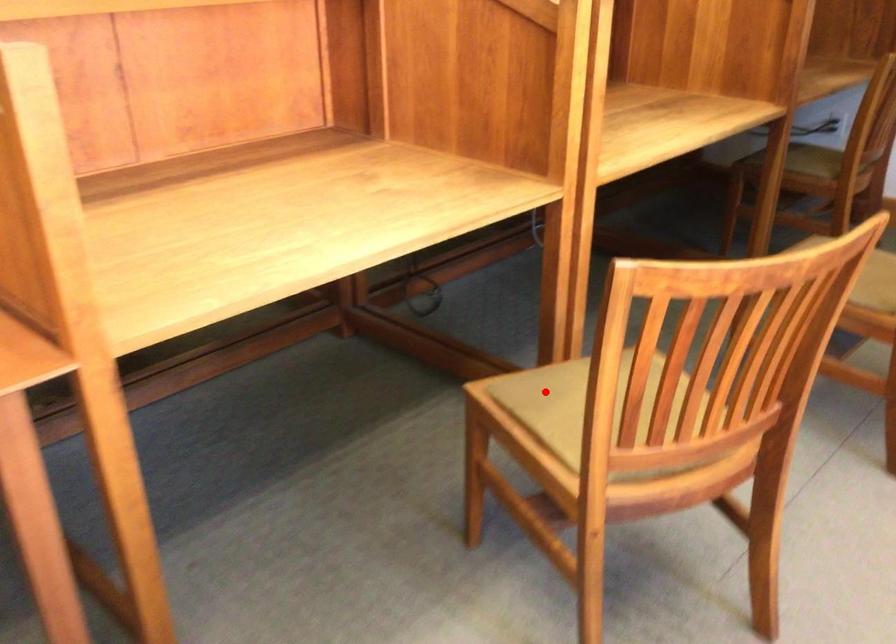
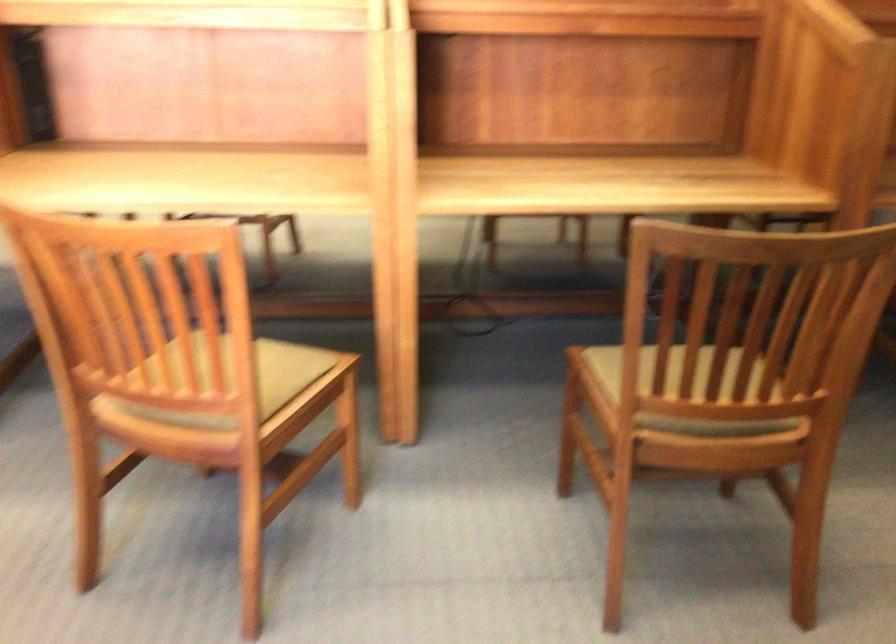
Question: I am providing you with two images of the same scene from different viewpoints. A red point is marked on the first image. At the location where the point appears in image 1, is it still visible in image 2?

Choices:
 (A) Yes
 (B) No

Answer: (B)